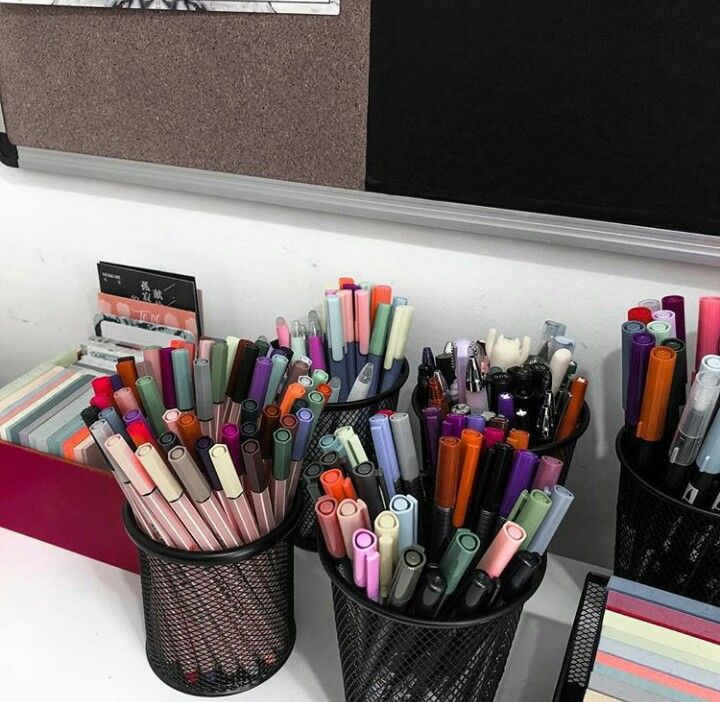
The height and width of the screenshot is (702, 720). I want to click on clear pen cap, so click(698, 408).